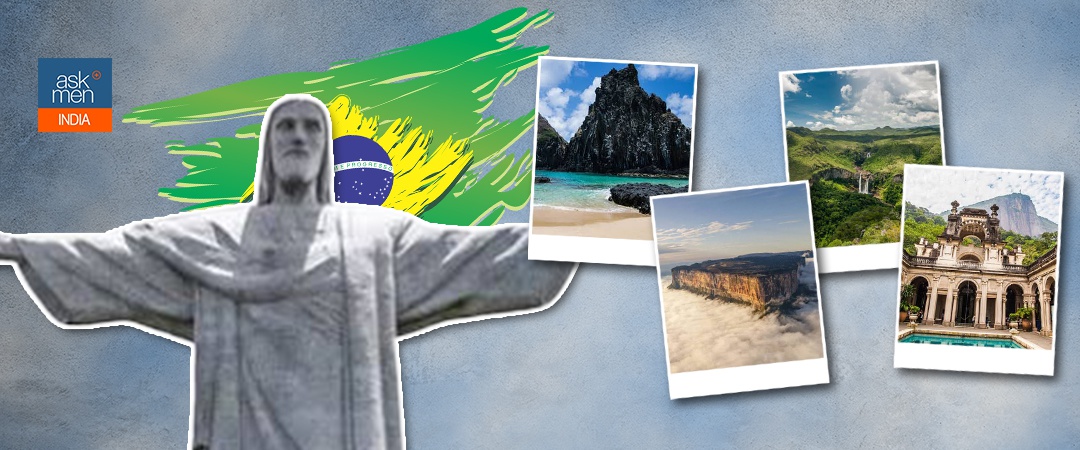
This screenshot has width=1080, height=450. I want to click on photographs, so 636,109, 725,272, 873,149, 986,236.